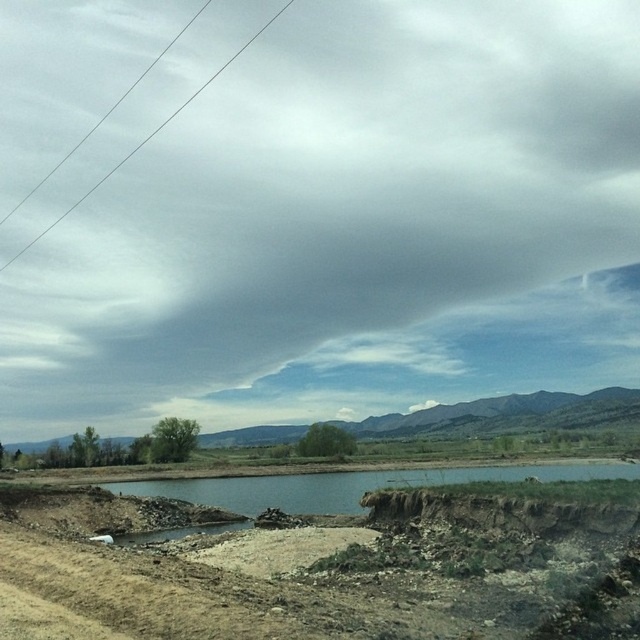
The image size is (640, 640). In order to click on gray/cloudy sky at upper center in this screenshot , I will do `click(339, 220)`.

Which is more to the left, gray/cloudy sky at upper center or smooth wire at upper left?

From the viewer's perspective, smooth wire at upper left appears more on the left side.

What do you see at coordinates (339, 220) in the screenshot? This screenshot has width=640, height=640. I see `gray/cloudy sky at upper center` at bounding box center [339, 220].

In order to click on gray/cloudy sky at upper center in this screenshot , I will do `click(339, 220)`.

Between smooth wire at upper left and brown dirt puddle at lower center, which one appears on the right side from the viewer's perspective?

brown dirt puddle at lower center

Is smooth wire at upper left shorter than brown dirt puddle at lower center?

No.

Find the location of `smooth wire at upper left`. smooth wire at upper left is located at coordinates (147, 138).

Does gray/cloudy sky at upper center have a lesser width compared to brown dirt puddle at lower center?

In fact, gray/cloudy sky at upper center might be wider than brown dirt puddle at lower center.

Is gray/cloudy sky at upper center taller than brown dirt puddle at lower center?

Yes.

Locate an element on the screen. This screenshot has width=640, height=640. gray/cloudy sky at upper center is located at coordinates (339, 220).